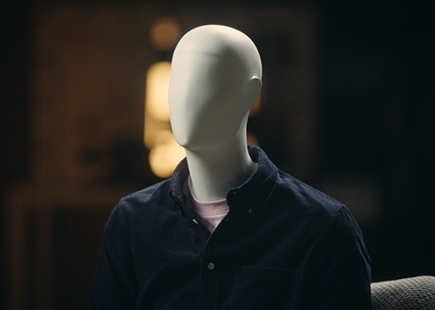
Identify the location of table. (77, 191).